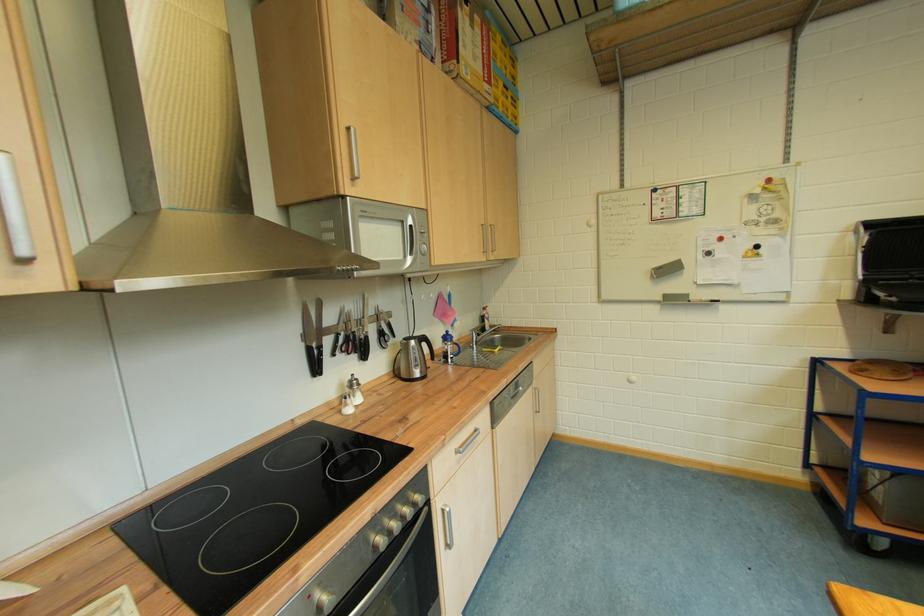
The width and height of the screenshot is (924, 616). In order to click on microwave dial in this screenshot , I will do `click(418, 243)`.